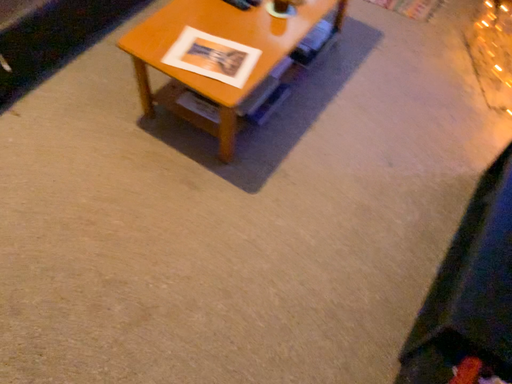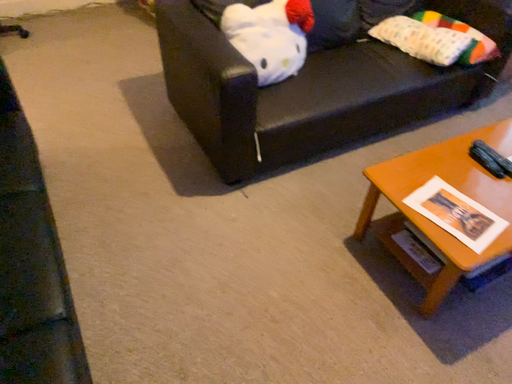
Question: Which way did the camera rotate in the video?

Choices:
 (A) rotated downward
 (B) rotated upward

Answer: (B)